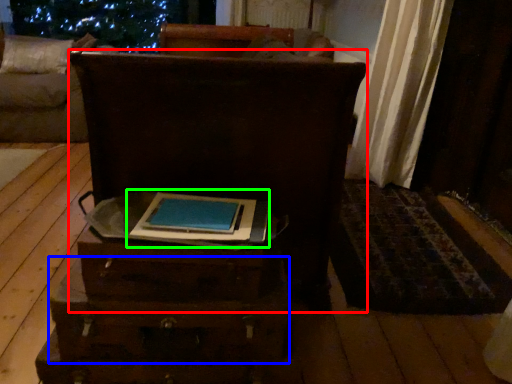
Question: Based on their relative distances, which object is nearer to furniture (highlighted by a red box)? Choose from drawer (highlighted by a blue box) and book (highlighted by a green box).

Choices:
 (A) drawer
 (B) book

Answer: (B)